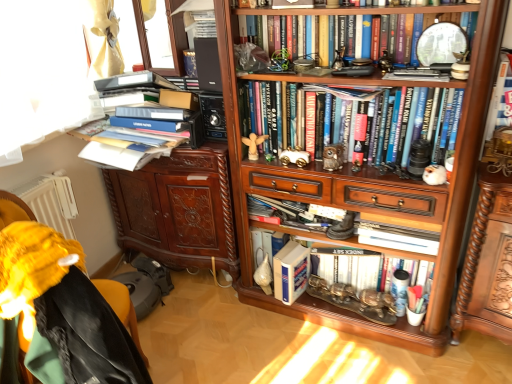
Question: Is hardcover books at center, which ranks as the 3th book in top-to-bottom order, to the left of white fur figurine at center-right from the viewer's perspective?

Choices:
 (A) yes
 (B) no

Answer: (A)

Question: Is hardcover books at center, the 3th book ordered from the bottom, positioned behind white fur figurine at center-right?

Choices:
 (A) no
 (B) yes

Answer: (A)

Question: Is hardcover books at center, which ranks as the 3th book in top-to-bottom order, aimed at white fur figurine at center-right?

Choices:
 (A) no
 (B) yes

Answer: (B)

Question: Considering the relative sizes of hardcover books at center, the 3th book ordered from the bottom, and white fur figurine at center-right in the image provided, is hardcover books at center, the 3th book ordered from the bottom, smaller than white fur figurine at center-right?

Choices:
 (A) yes
 (B) no

Answer: (B)

Question: Is hardcover books at center, which ranks as the 3th book in top-to-bottom order, not close to white fur figurine at center-right?

Choices:
 (A) no
 (B) yes

Answer: (A)

Question: Considering the positions of white fur figurine at center-right and black matte speaker at upper center in the image, is white fur figurine at center-right taller or shorter than black matte speaker at upper center?

Choices:
 (A) tall
 (B) short

Answer: (B)

Question: Considering the relative positions of white fur figurine at center-right and black matte speaker at upper center in the image provided, is white fur figurine at center-right to the left or to the right of black matte speaker at upper center?

Choices:
 (A) left
 (B) right

Answer: (B)

Question: Considering the positions of white fur figurine at center-right and black matte speaker at upper center in the image, is white fur figurine at center-right bigger or smaller than black matte speaker at upper center?

Choices:
 (A) small
 (B) big

Answer: (A)

Question: From the image's perspective, is white fur figurine at center-right above or below black matte speaker at upper center?

Choices:
 (A) above
 (B) below

Answer: (B)

Question: Considering the positions of point (349, 304) and point (232, 266), is point (349, 304) closer or farther from the camera than point (232, 266)?

Choices:
 (A) closer
 (B) farther

Answer: (A)

Question: From their relative heights in the image, would you say white matte book at center, acting as the 4th book starting from the top, is taller or shorter than brown carved cabinet at left?

Choices:
 (A) short
 (B) tall

Answer: (A)

Question: Is white matte book at center, marked as the 2th book in a bottom-to-top arrangement, wider or thinner than brown carved cabinet at left?

Choices:
 (A) wide
 (B) thin

Answer: (B)

Question: From the image's perspective, is white matte book at center, marked as the 2th book in a bottom-to-top arrangement, located above or below brown carved cabinet at left?

Choices:
 (A) below
 (B) above

Answer: (A)

Question: From a real-world perspective, is black matte speaker at upper center above or below hardcover book at upper right, which appears as the 2th book when viewed from the top?

Choices:
 (A) below
 (B) above

Answer: (B)

Question: From the image's perspective, is black matte speaker at upper center above or below hardcover book at upper right, which appears as the 2th book when viewed from the top?

Choices:
 (A) below
 (B) above

Answer: (B)